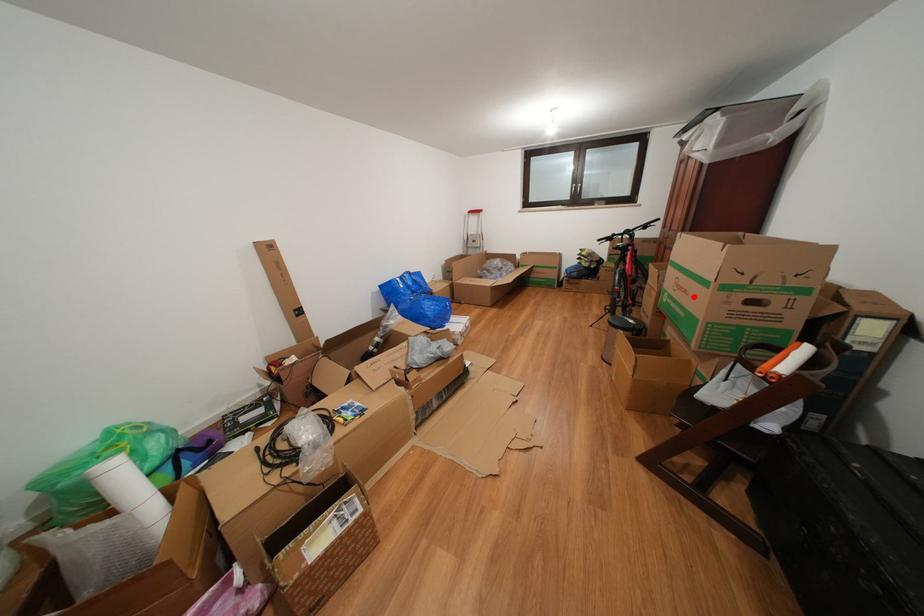
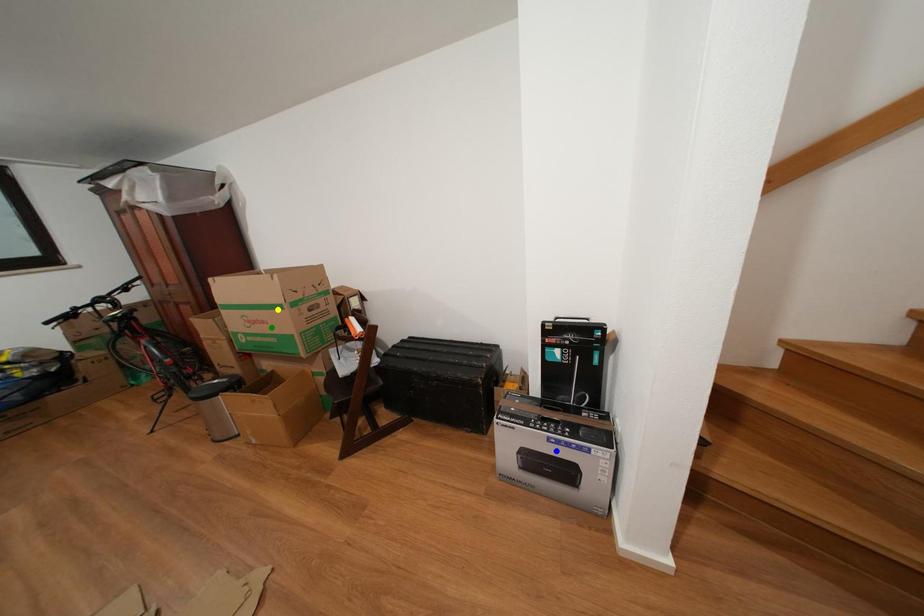
Question: I am providing you with two images of the same scene from different viewpoints. A red point is marked on the first image. You are given multiple points on the second image. Which spot in image 2 lines up with the point in image 1?

Choices:
 (A) yellow point
 (B) blue point
 (C) green point

Answer: (C)